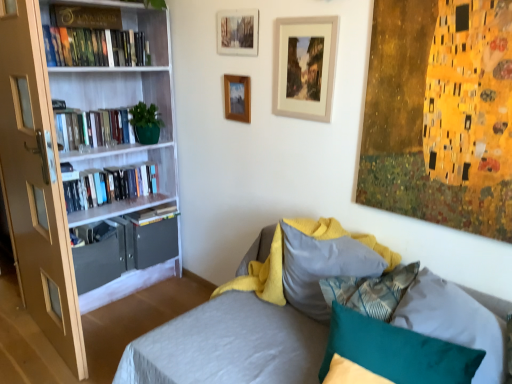
Identify the location of blank space above hardcover book at left, which is counted as the fourth book, starting from the bottom (from a real-world perspective). (82, 22).